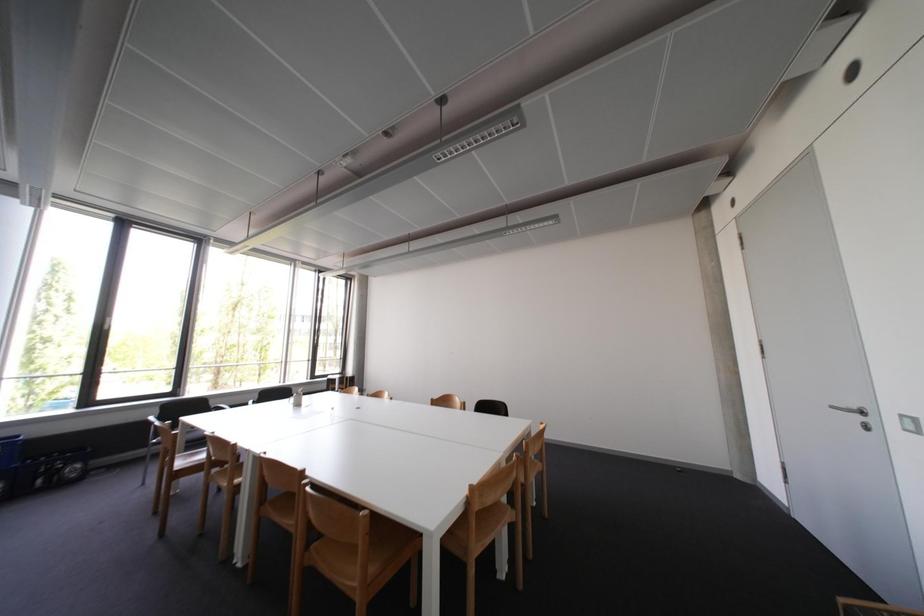
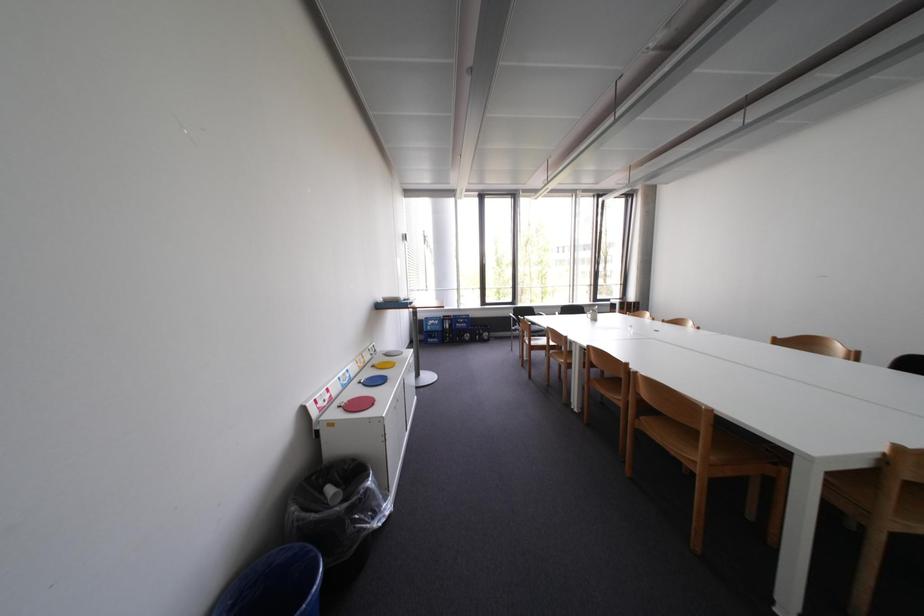
Question: Based on the continuous images, in which direction is the camera rotating? Reply with the corresponding letter.

Choices:
 (A) Left
 (B) Right
 (C) Up
 (D) Down

Answer: (A)